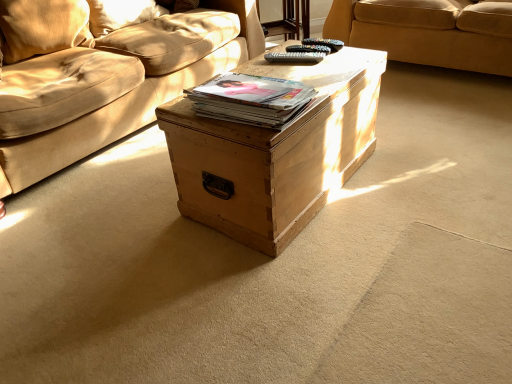
Question: Could you tell me if natural wood trunk at center is facing velvet beige pillow at upper left, which is the first pillow in front-to-back order?

Choices:
 (A) yes
 (B) no

Answer: (B)

Question: Can you confirm if natural wood trunk at center is smaller than velvet beige pillow at upper left, which is the first pillow in front-to-back order?

Choices:
 (A) no
 (B) yes

Answer: (A)

Question: From a real-world perspective, is natural wood trunk at center on velvet beige pillow at upper left, the second pillow in the back-to-front sequence?

Choices:
 (A) no
 (B) yes

Answer: (A)

Question: From the image's perspective, is natural wood trunk at center beneath velvet beige pillow at upper left, which is the first pillow in front-to-back order?

Choices:
 (A) yes
 (B) no

Answer: (A)

Question: Does natural wood trunk at center have a greater height compared to velvet beige pillow at upper left, the second pillow in the back-to-front sequence?

Choices:
 (A) no
 (B) yes

Answer: (B)

Question: From the image's perspective, is natural wood trunk at center on velvet beige pillow at upper left, the second pillow in the back-to-front sequence?

Choices:
 (A) yes
 (B) no

Answer: (B)

Question: Does matte brown book at center have a larger size compared to soft beige pillow at upper left, the second pillow viewed from the front?

Choices:
 (A) yes
 (B) no

Answer: (B)

Question: From the image's perspective, is matte brown book at center beneath soft beige pillow at upper left, the second pillow viewed from the front?

Choices:
 (A) no
 (B) yes

Answer: (B)

Question: Can you confirm if matte brown book at center is thinner than soft beige pillow at upper left, which is counted as the 1th pillow, starting from the back?

Choices:
 (A) yes
 (B) no

Answer: (B)

Question: Considering the relative sizes of matte brown book at center and soft beige pillow at upper left, the second pillow viewed from the front, in the image provided, is matte brown book at center wider than soft beige pillow at upper left, the second pillow viewed from the front,?

Choices:
 (A) yes
 (B) no

Answer: (A)

Question: From the image's perspective, is matte brown book at center on top of soft beige pillow at upper left, which is counted as the 1th pillow, starting from the back?

Choices:
 (A) yes
 (B) no

Answer: (B)

Question: From a real-world perspective, is matte brown book at center on soft beige pillow at upper left, which is counted as the 1th pillow, starting from the back?

Choices:
 (A) no
 (B) yes

Answer: (A)

Question: From the image's perspective, is velvet beige pillow at upper left, the second pillow in the back-to-front sequence, over beige fabric couch at upper center?

Choices:
 (A) yes
 (B) no

Answer: (B)